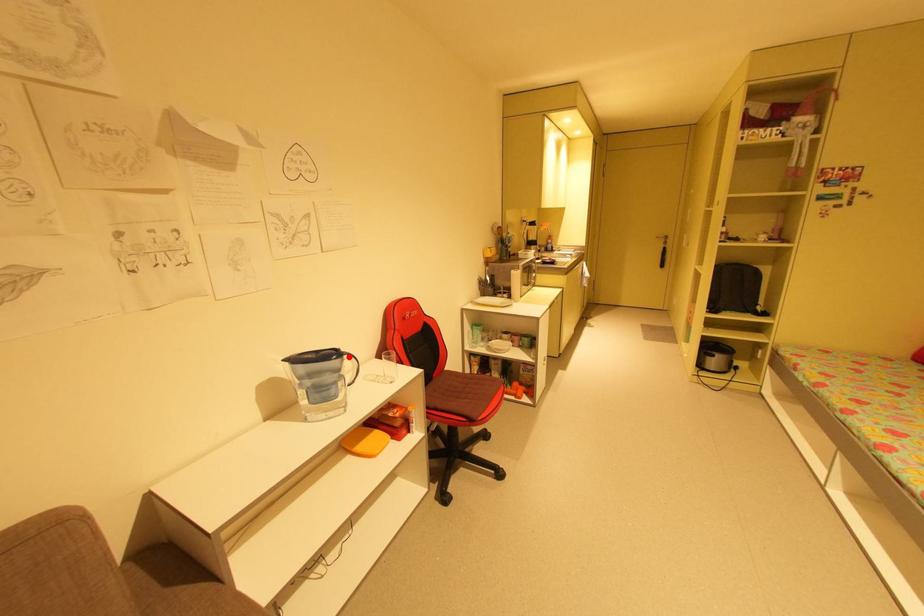
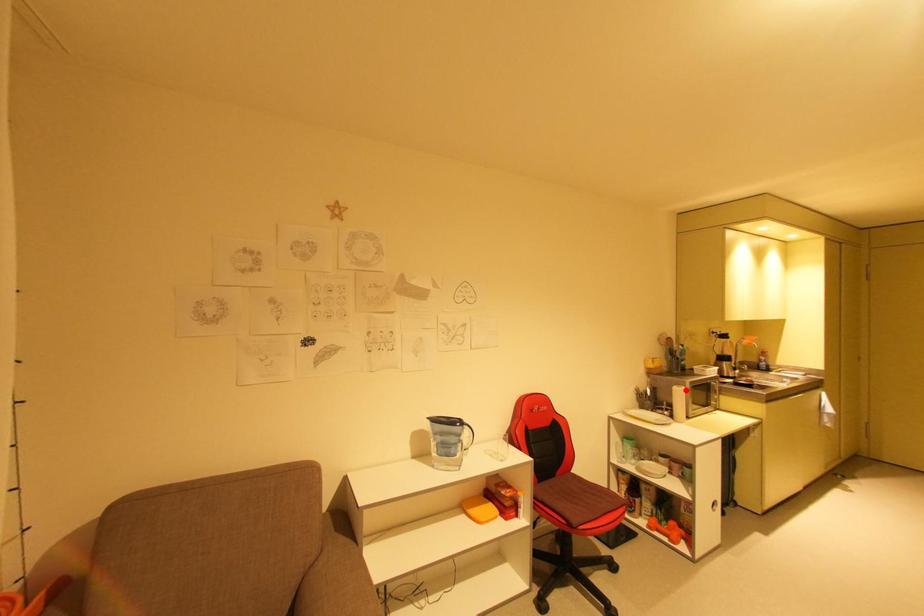
I am providing you with two images of the same scene from different viewpoints. A red point is marked on the first image and another point is marked on the second image. Does the point marked in image1 correspond to the same location as the one in image2?

No